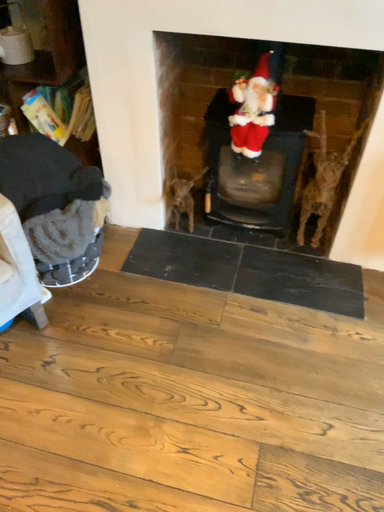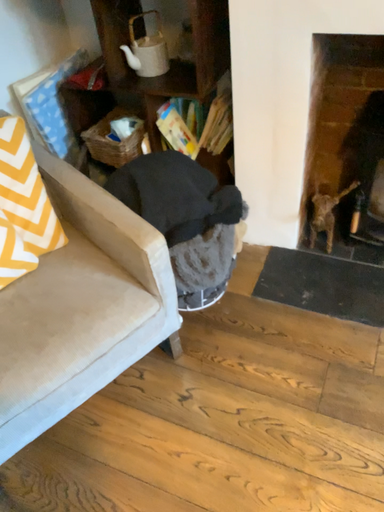
Question: How did the camera likely rotate when shooting the video?

Choices:
 (A) rotated right
 (B) rotated left

Answer: (B)